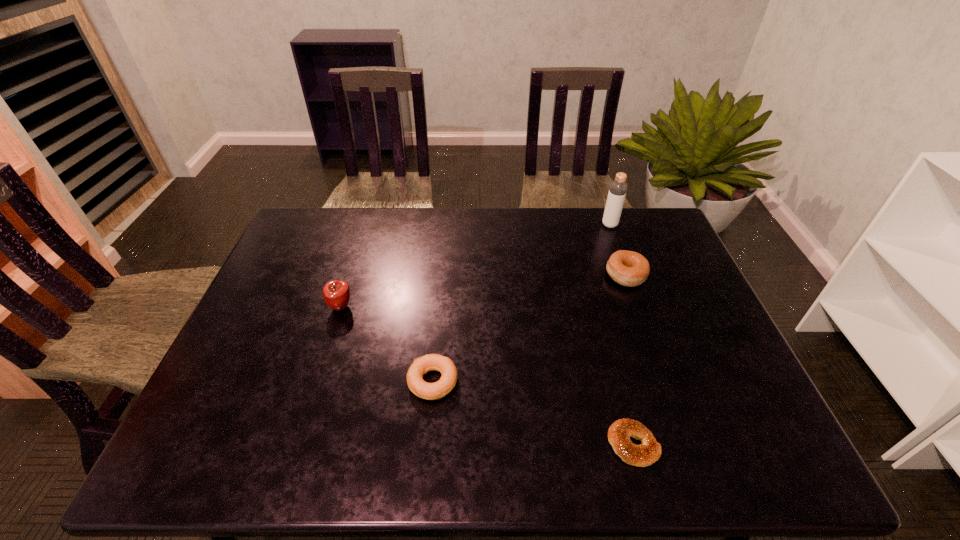
I want to click on vacant area in the image that satisfies the following two spatial constraints: 1. on the front side of the shortest object; 2. on the right side of the second tallest object, so click(x=298, y=444).

What are the coordinates of `free region that satisfies the following two spatial constraints: 1. on the back side of the second tallest object; 2. on the right side of the third shortest object` in the screenshot? It's located at (351, 275).

This screenshot has height=540, width=960. Identify the location of blank space that satisfies the following two spatial constraints: 1. on the back side of the nearest bagel; 2. on the right side of the fourth nearest object. (588, 275).